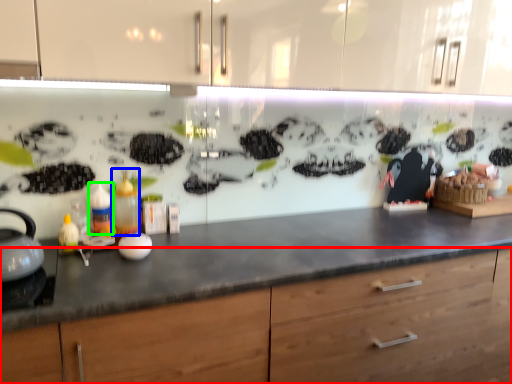
Question: Based on their relative distances, which object is farther from cabinetry (highlighted by a red box)? Choose from bottle (highlighted by a blue box) and bottle (highlighted by a green box).

Choices:
 (A) bottle
 (B) bottle

Answer: (B)